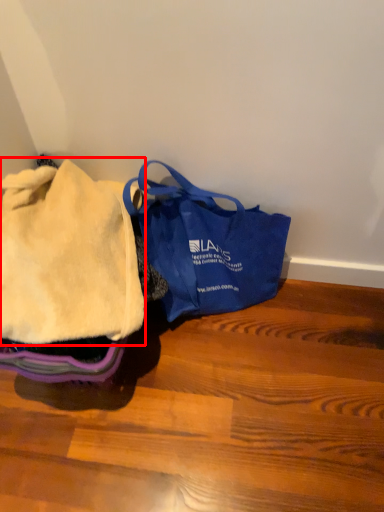
Question: Where is cloth (annotated by the red box) located in relation to handbag in the image?

Choices:
 (A) right
 (B) left

Answer: (B)